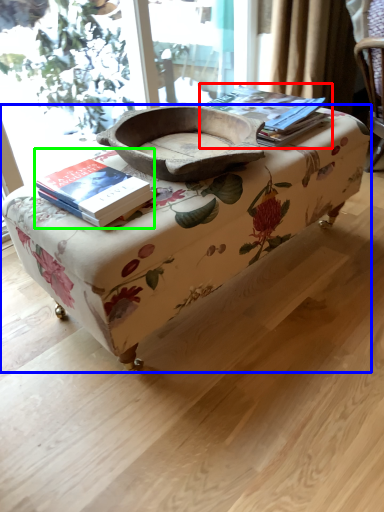
Question: Which object is the closest to the paperback book (highlighted by a red box)? Choose among these: table (highlighted by a blue box) or book (highlighted by a green box).

Choices:
 (A) table
 (B) book

Answer: (A)